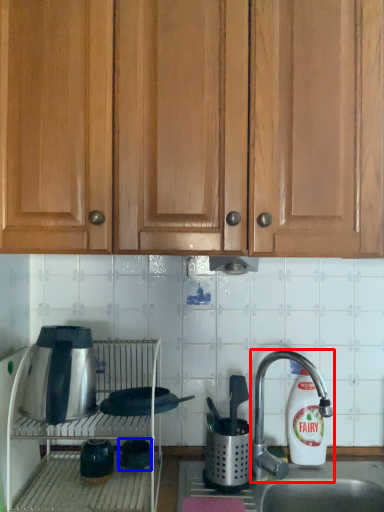
Question: Which of the following is the closest to the observer, faucet (highlighted by a red box) or appliance (highlighted by a blue box)?

Choices:
 (A) faucet
 (B) appliance

Answer: (A)